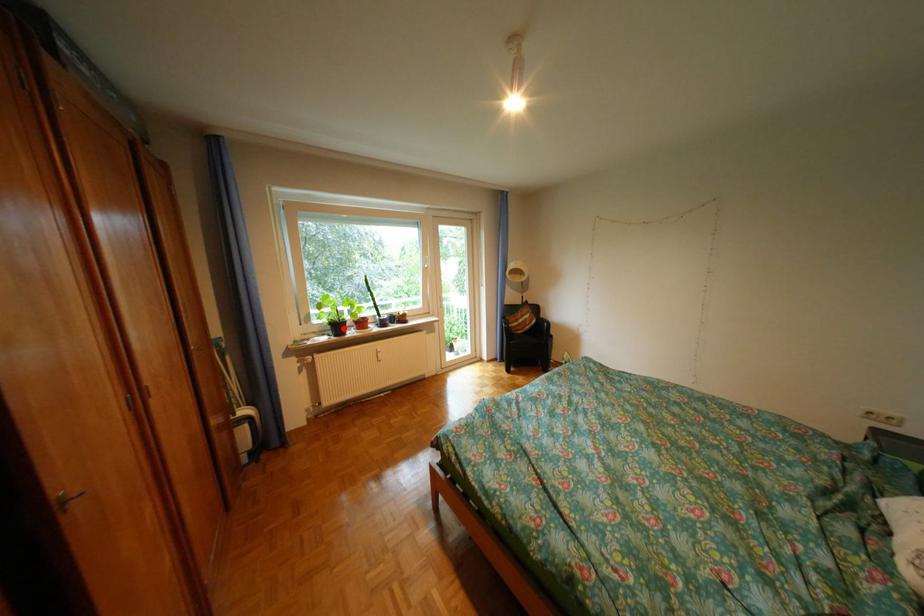
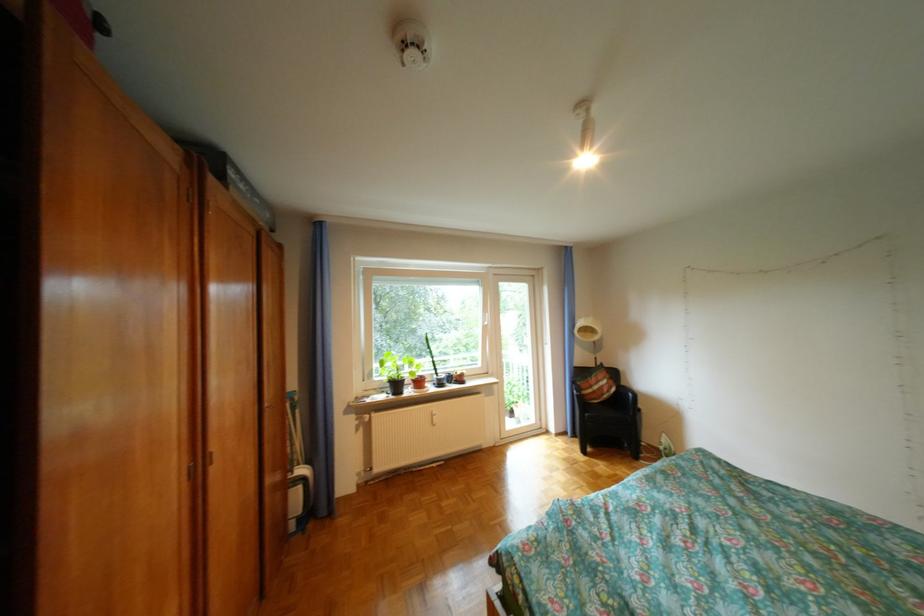
Where in the second image is the point corresponding to the highlighted location from the first image?

(403, 386)